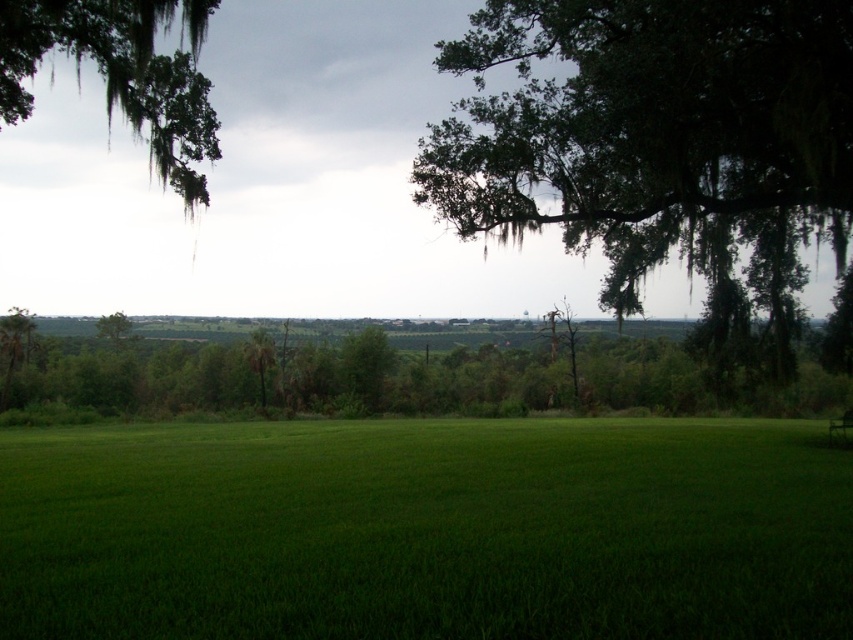
Is point (813, 552) behind point (457, 108)?

No, it is in front of (457, 108).

Between green grass at center and green leafy tree at upper right, which one appears on the right side from the viewer's perspective?

green leafy tree at upper right

You are a GUI agent. You are given a task and a screenshot of the screen. Output one action in this format:
    pyautogui.click(x=<x>, y=<y>)
    Task: Click on the green grass at center
    The height and width of the screenshot is (640, 853).
    Given the screenshot: What is the action you would take?
    pyautogui.click(x=426, y=531)

Is point (567, 120) in front of point (135, 88)?

No, it is not.

Is green leafy tree at upper right shorter than green mossy branch at upper left?

Indeed, green leafy tree at upper right has a lesser height compared to green mossy branch at upper left.

Locate an element on the screen. green leafy tree at upper right is located at coordinates (656, 138).

Does green leafy tree at upper right lie in front of green leafy tree at center?

Yes.

Does point (583, 211) come closer to viewer compared to point (115, 340)?

Yes, it is.

This screenshot has width=853, height=640. I want to click on green leafy tree at upper right, so click(656, 138).